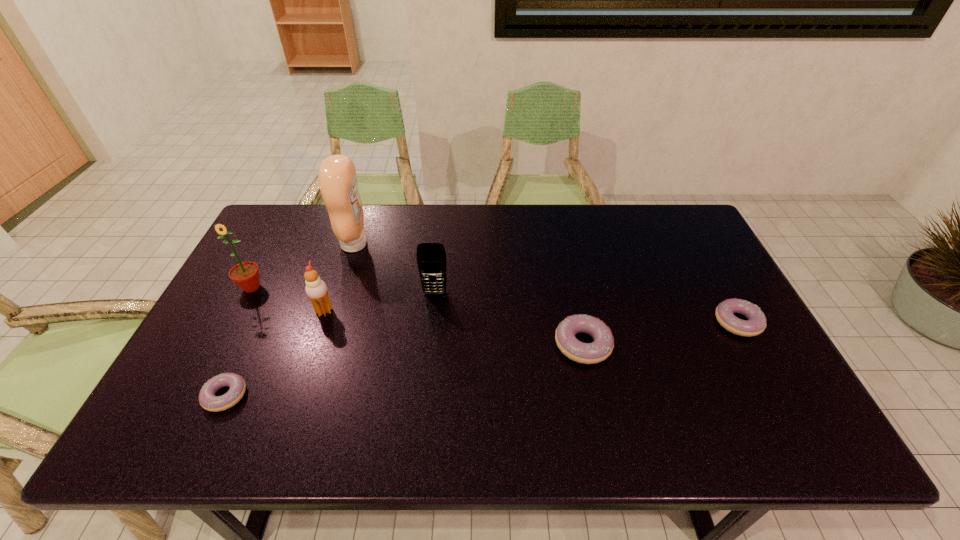
Locate an element on the screen. doughnut located at the left edge is located at coordinates (208, 400).

At what (x,y) coordinates should I click in order to perform the action: click on sunflower situated at the left edge. Please return your answer as a coordinate pair (x, y). The height and width of the screenshot is (540, 960). Looking at the image, I should click on click(246, 274).

Locate an element on the screen. The image size is (960, 540). object positioned at the right edge is located at coordinates (756, 323).

This screenshot has width=960, height=540. Identify the location of object that is positioned at the near left corner. (208, 400).

Locate an element on the screen. vacant region at the far edge of the desktop is located at coordinates (509, 228).

This screenshot has width=960, height=540. What are the coordinates of `free location at the near edge of the desktop` in the screenshot? It's located at (432, 406).

In the image, there is a desktop. Where is `vacant space at the left edge`? The image size is (960, 540). vacant space at the left edge is located at coordinates (273, 254).

Where is `free region at the far right corner of the desktop`? This screenshot has height=540, width=960. free region at the far right corner of the desktop is located at coordinates (670, 222).

You are a GUI agent. You are given a task and a screenshot of the screen. Output one action in this format:
    pyautogui.click(x=<x>, y=<y>)
    Task: Click on the vacant point located between the icecream and the second object from right to left
    
    Given the screenshot: What is the action you would take?
    pyautogui.click(x=453, y=328)

Where is `free space between the leftmost doughnut and the rightmost doughnut`? The image size is (960, 540). free space between the leftmost doughnut and the rightmost doughnut is located at coordinates (482, 359).